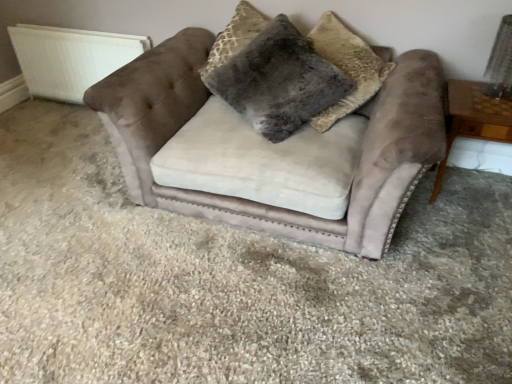
Image resolution: width=512 pixels, height=384 pixels. I want to click on vacant space in between velvet couch at center and wooden side table at right, so click(x=448, y=241).